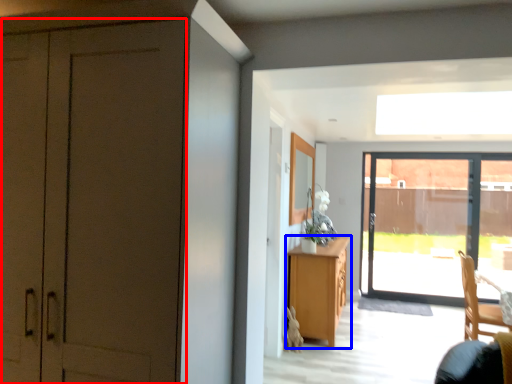
Question: Which object is closer to the camera taking this photo, door (highlighted by a red box) or cabinetry (highlighted by a blue box)?

Choices:
 (A) door
 (B) cabinetry

Answer: (A)